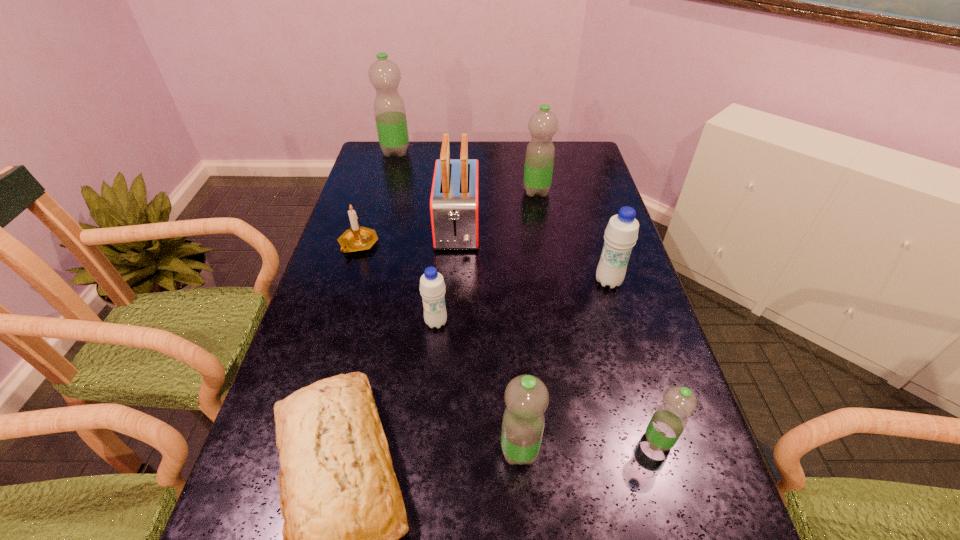
This screenshot has height=540, width=960. I want to click on the smaller blue water bottle, so click(x=432, y=287).

You are a GUI agent. You are given a task and a screenshot of the screen. Output one action in this format:
    pyautogui.click(x=<x>, y=<y>)
    Task: Click on the smallest green water bottle
    The width and height of the screenshot is (960, 540).
    Given the screenshot: What is the action you would take?
    pyautogui.click(x=669, y=420)

Find the location of a particular element. The image size is (960, 540). gold candle holder is located at coordinates (357, 238).

Locate an element on the screen. Image resolution: width=960 pixels, height=540 pixels. free space located on the front of the tallest object is located at coordinates (383, 196).

Image resolution: width=960 pixels, height=540 pixels. Identify the location of free spot located on the left of the second farthest water bottle. (508, 192).

At what (x,y) coordinates should I click in order to perform the action: click on vacant area situated 0.120m on the front-facing side of the red toaster. Please return your answer as a coordinate pair (x, y). Looking at the image, I should click on (454, 286).

I want to click on vacant region located on the back of the third water bottle from left to right, so click(x=513, y=352).

Identify the location of vacant space located on the back of the right blue water bottle. (586, 204).

Find the location of a particular element. The image size is (960, 540). vacant space situated 0.110m on the back of the smaller blue water bottle is located at coordinates (440, 283).

Where is `vacant space located on the left of the rightmost green water bottle`? Image resolution: width=960 pixels, height=540 pixels. vacant space located on the left of the rightmost green water bottle is located at coordinates (514, 441).